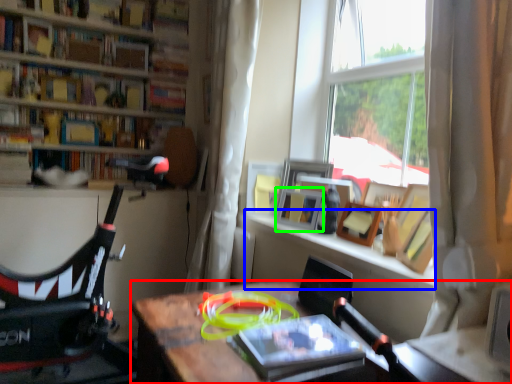
Question: Estimate the real-world distances between objects in this image. Which object is closer to desk (highlighted by a red box), window sill (highlighted by a blue box) or picture frame (highlighted by a green box)?

Choices:
 (A) window sill
 (B) picture frame

Answer: (A)